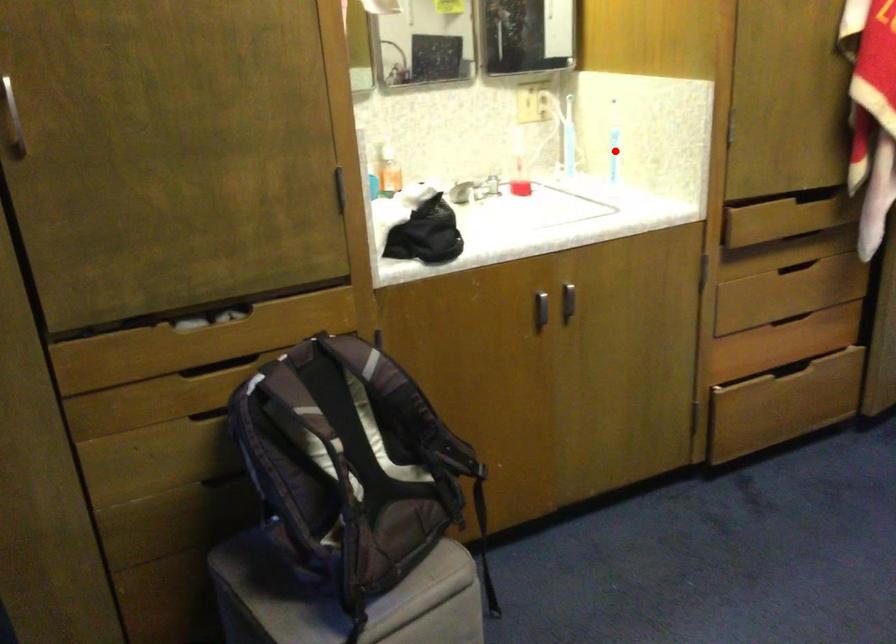
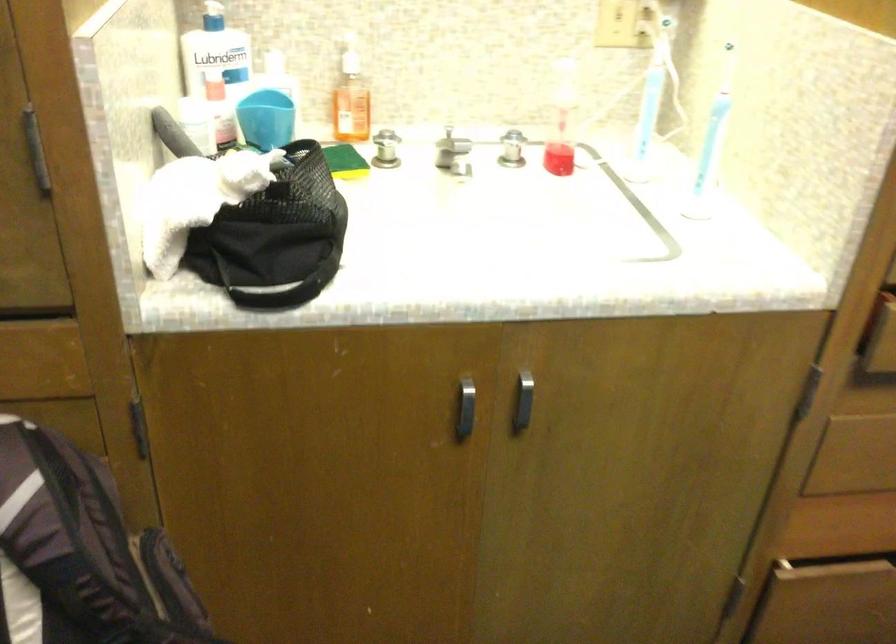
Question: I am providing you with two images of the same scene from different viewpoints. Given a red point in image1, look at the same physical point in image2. Is it:

Choices:
 (A) Closer to the viewpoint
 (B) Farther from the viewpoint

Answer: (A)